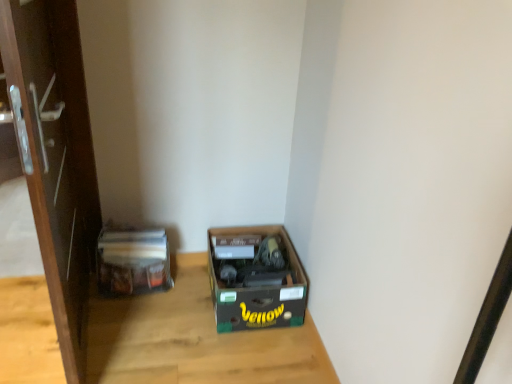
Question: Is matte plastic bag at left taller than wooden table at center?

Choices:
 (A) yes
 (B) no

Answer: (A)

Question: Is matte plastic bag at left wider than wooden table at center?

Choices:
 (A) yes
 (B) no

Answer: (B)

Question: From the image's perspective, is matte plastic bag at left on top of wooden table at center?

Choices:
 (A) no
 (B) yes

Answer: (B)

Question: From the image's perspective, is matte plastic bag at left under wooden table at center?

Choices:
 (A) no
 (B) yes

Answer: (A)

Question: Can you confirm if matte plastic bag at left is thinner than wooden table at center?

Choices:
 (A) yes
 (B) no

Answer: (A)

Question: Does matte plastic bag at left lie in front of wooden table at center?

Choices:
 (A) no
 (B) yes

Answer: (A)

Question: Are brown glossy door at left and brown cardboard box at lower center far apart?

Choices:
 (A) no
 (B) yes

Answer: (A)

Question: From the image's perspective, is brown glossy door at left located above brown cardboard box at lower center?

Choices:
 (A) no
 (B) yes

Answer: (B)

Question: Can you confirm if brown glossy door at left is smaller than brown cardboard box at lower center?

Choices:
 (A) yes
 (B) no

Answer: (B)

Question: From a real-world perspective, is brown glossy door at left physically above brown cardboard box at lower center?

Choices:
 (A) yes
 (B) no

Answer: (A)

Question: Is brown glossy door at left facing away from brown cardboard box at lower center?

Choices:
 (A) no
 (B) yes

Answer: (B)

Question: From a real-world perspective, is brown glossy door at left located beneath brown cardboard box at lower center?

Choices:
 (A) no
 (B) yes

Answer: (A)

Question: Is brown glossy door at left to the left of matte plastic bag at left from the viewer's perspective?

Choices:
 (A) no
 (B) yes

Answer: (B)